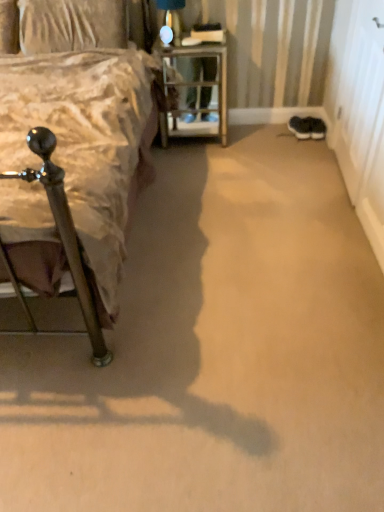
Locate an element on the screen. This screenshot has height=512, width=384. vacant position to the left of black suede sneakers at lower right, the 1th footwear viewed from the left is located at coordinates (275, 132).